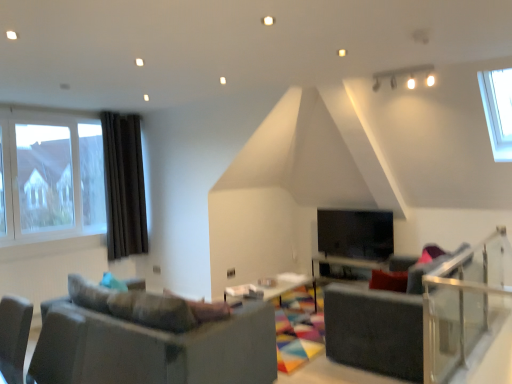
Question: Does wooden table at center, acting as the first table starting from the right, appear on the left side of clear glass balustrade at right?

Choices:
 (A) yes
 (B) no

Answer: (A)

Question: Is wooden table at center, acting as the first table starting from the right, positioned with its back to clear glass balustrade at right?

Choices:
 (A) yes
 (B) no

Answer: (B)

Question: From the image's perspective, would you say wooden table at center, acting as the 2th table starting from the front, is shown under clear glass balustrade at right?

Choices:
 (A) no
 (B) yes

Answer: (B)

Question: From a real-world perspective, is wooden table at center, acting as the 2th table starting from the front, located beneath clear glass balustrade at right?

Choices:
 (A) no
 (B) yes

Answer: (B)

Question: Does wooden table at center, acting as the 2th table starting from the front, have a lesser height compared to clear glass balustrade at right?

Choices:
 (A) no
 (B) yes

Answer: (B)

Question: Considering the positions of wooden table at center, which ranks as the second table in back-to-front order, and black glass fireplace at center in the image, is wooden table at center, which ranks as the second table in back-to-front order, bigger or smaller than black glass fireplace at center?

Choices:
 (A) small
 (B) big

Answer: (B)

Question: In terms of width, does wooden table at center, the 1th table positioned from the front, look wider or thinner when compared to black glass fireplace at center?

Choices:
 (A) wide
 (B) thin

Answer: (A)

Question: Is wooden table at center, the 1th table when ordered from left to right, in front of or behind black glass fireplace at center in the image?

Choices:
 (A) front
 (B) behind

Answer: (A)

Question: From a real-world perspective, relative to black glass fireplace at center, is wooden table at center, the 1th table when ordered from left to right, vertically above or below?

Choices:
 (A) below
 (B) above

Answer: (A)

Question: From a real-world perspective, is clear glass window at left physically located above or below black glass fireplace at center?

Choices:
 (A) below
 (B) above

Answer: (B)

Question: Is clear glass window at left taller or shorter than black glass fireplace at center?

Choices:
 (A) tall
 (B) short

Answer: (A)

Question: Do you think clear glass window at left is within black glass fireplace at center, or outside of it?

Choices:
 (A) inside
 (B) outside

Answer: (B)

Question: Considering their positions, is clear glass window at left located in front of or behind black glass fireplace at center?

Choices:
 (A) behind
 (B) front

Answer: (B)

Question: Considering their positions, is dark gray fabric armchair at center located in front of or behind wooden table at center, acting as the 2th table starting from the front?

Choices:
 (A) behind
 (B) front

Answer: (B)

Question: Is dark gray fabric armchair at center bigger or smaller than wooden table at center, the first table from the back?

Choices:
 (A) small
 (B) big

Answer: (B)